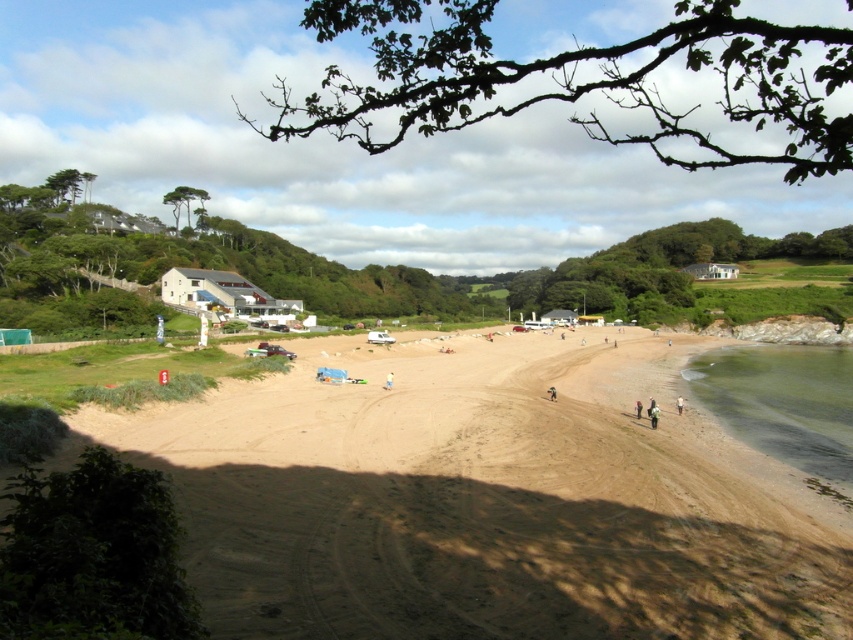
Is brown sand at center smaller than clear water at lower right?

No, brown sand at center is not smaller than clear water at lower right.

Does brown sand at center have a greater width compared to clear water at lower right?

Incorrect, brown sand at center's width does not surpass clear water at lower right's.

Describe the element at coordinates (486, 499) in the screenshot. The width and height of the screenshot is (853, 640). I see `brown sand at center` at that location.

At what (x,y) coordinates should I click in order to perform the action: click on brown sand at center. Please return your answer as a coordinate pair (x, y). The width and height of the screenshot is (853, 640). Looking at the image, I should click on (486, 499).

Who is more distant from viewer, (648,403) or (392,378)?

Point (648,403)

Measure the distance between point (648, 413) and camera.

Point (648, 413) is 39.55 meters from camera.

The image size is (853, 640). What do you see at coordinates (653, 413) in the screenshot?
I see `green fabric jacket at lower right` at bounding box center [653, 413].

Where is `green fabric jacket at lower right`? The image size is (853, 640). green fabric jacket at lower right is located at coordinates (653, 413).

Is yellow fabric at center positioned in front of light brown sand at lower right?

No, yellow fabric at center is further to the viewer.

This screenshot has height=640, width=853. What do you see at coordinates (387, 380) in the screenshot? I see `yellow fabric at center` at bounding box center [387, 380].

You are a GUI agent. You are given a task and a screenshot of the screen. Output one action in this format:
    pyautogui.click(x=<x>, y=<y>)
    Task: Click on the yellow fabric at center
    
    Given the screenshot: What is the action you would take?
    pyautogui.click(x=387, y=380)